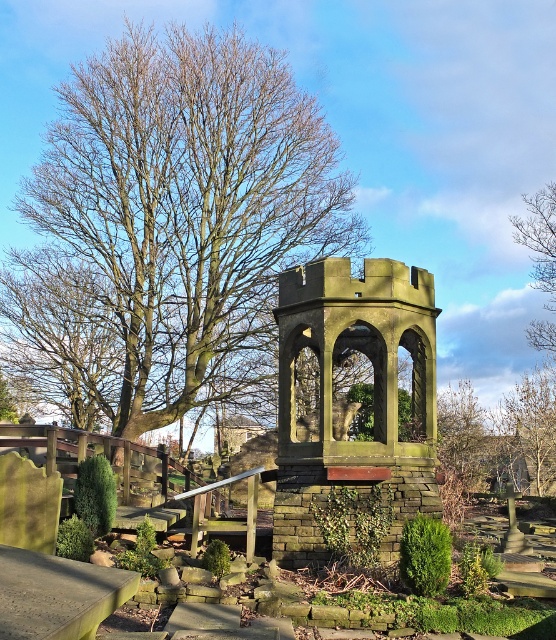
Question: Which of the following is the farthest from the observer?

Choices:
 (A) bare wood tree at upper left
 (B) green stone gazebo at center

Answer: (A)

Question: Which point is closer to the camera taking this photo?

Choices:
 (A) (71, 353)
 (B) (405, 557)
 (C) (538, 275)
 (D) (285, 380)

Answer: (B)

Question: Can you confirm if bare wood tree at upper left is bigger than green leafy hedge at center?

Choices:
 (A) no
 (B) yes

Answer: (B)

Question: Is green stone gazebo at center bigger than bare branches at upper right?

Choices:
 (A) yes
 (B) no

Answer: (B)

Question: Does bare wood tree at upper left have a greater width compared to green leafy hedge at lower center?

Choices:
 (A) no
 (B) yes

Answer: (B)

Question: Which object is farther from the camera taking this photo?

Choices:
 (A) green stone gazebo at center
 (B) bare branches at upper right
 (C) green leafy hedge at center

Answer: (B)